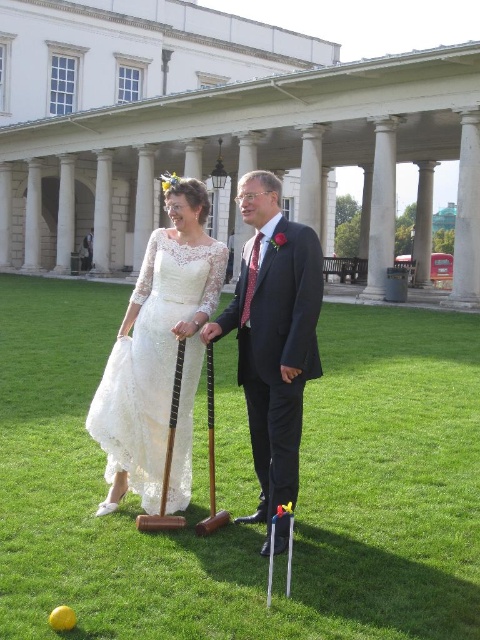
Which is behind, point (456, 412) or point (197, 253)?

Point (456, 412)

Find the location of a particular element. green grass at center is located at coordinates (250, 525).

Is green grass at center taller than matte black suit at center?

No, green grass at center is not taller than matte black suit at center.

Between point (311, 502) and point (308, 237), which one is positioned in front?

Point (311, 502)

The width and height of the screenshot is (480, 640). In order to click on green grass at center in this screenshot , I will do `click(250, 525)`.

Who is lower down, matte black suit at center or lace dress at center?

matte black suit at center

Does matte black suit at center appear under lace dress at center?

Correct, matte black suit at center is located below lace dress at center.

Which is behind, point (253, 458) or point (187, 483)?

Positioned behind is point (187, 483).

Find the location of a particular element. Image resolution: width=480 pixels, height=640 pixels. matte black suit at center is located at coordinates (274, 337).